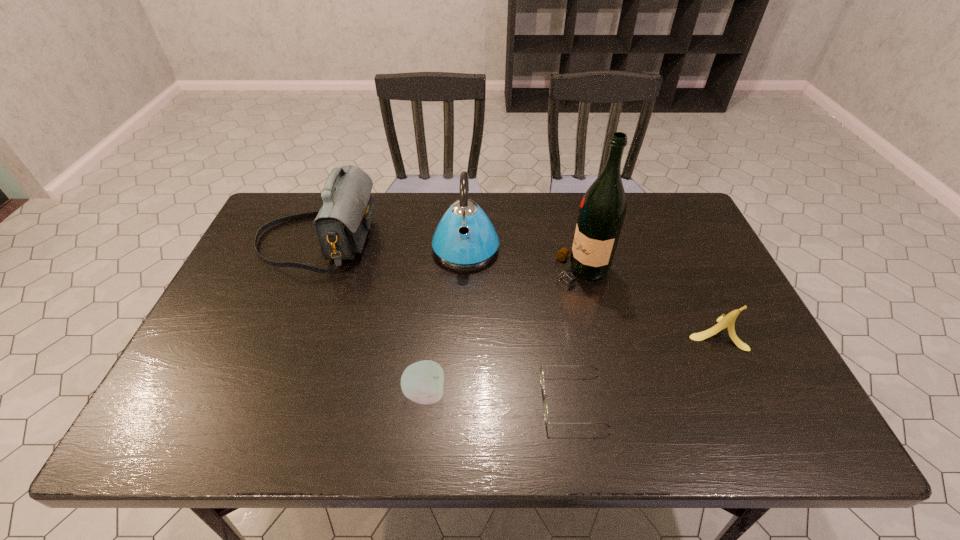
The image size is (960, 540). I want to click on sunglasses present at the near edge, so click(x=541, y=369).

This screenshot has width=960, height=540. What are the coordinates of `object that is positioned at the left edge` in the screenshot? It's located at (342, 223).

Locate an element on the screen. object positioned at the right edge is located at coordinates (728, 321).

You are a GUI agent. You are given a task and a screenshot of the screen. Output one action in this format:
    pyautogui.click(x=<x>, y=<y>)
    Task: Click on the object present at the far left corner
    
    Given the screenshot: What is the action you would take?
    pyautogui.click(x=342, y=223)

Locate an element on the screen. Image resolution: width=960 pixels, height=540 pixels. vacant space at the far edge of the desktop is located at coordinates (520, 231).

Identify the location of vacant region at the near edge of the desktop. (660, 446).

You are a GUI agent. You are given a task and a screenshot of the screen. Output one action in this format:
    pyautogui.click(x=<x>, y=<y>)
    Task: Click on the vacant space at the left edge of the desktop
    Image resolution: width=960 pixels, height=540 pixels.
    Given the screenshot: What is the action you would take?
    pyautogui.click(x=208, y=331)

Where is `vacant point at the right edge`? The height and width of the screenshot is (540, 960). vacant point at the right edge is located at coordinates (759, 374).

This screenshot has height=540, width=960. I want to click on vacant space at the far right corner, so click(x=690, y=228).

I want to click on unoccupied area between the apple and the kettle, so click(445, 320).